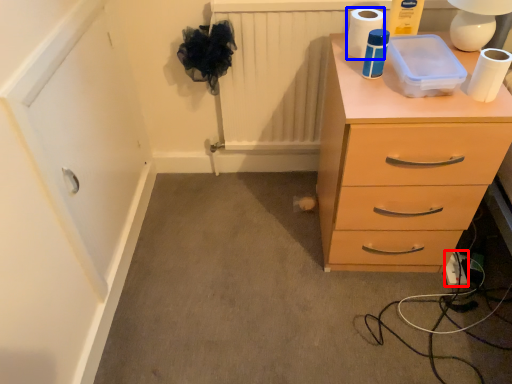
Question: Which object appears farthest to the camera in this image, extension cord (highlighted by a red box) or toilet paper (highlighted by a blue box)?

Choices:
 (A) extension cord
 (B) toilet paper

Answer: (A)